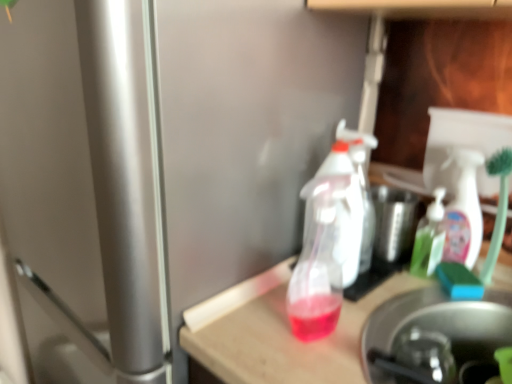
Question: Could translucent plastic spray bottle at center, the 1th bottle when ordered from left to right, be considered to be inside translucent plastic table at center?

Choices:
 (A) yes
 (B) no

Answer: (B)

Question: Is translucent plastic table at center next to translucent plastic spray bottle at center, positioned as the first bottle in front-to-back order?

Choices:
 (A) yes
 (B) no

Answer: (B)

Question: Does translucent plastic table at center have a greater height compared to translucent plastic spray bottle at center, the 1th bottle when ordered from left to right?

Choices:
 (A) yes
 (B) no

Answer: (A)

Question: Can you confirm if translucent plastic table at center is thinner than translucent plastic spray bottle at center, the 2th bottle positioned from the back?

Choices:
 (A) yes
 (B) no

Answer: (B)

Question: Is translucent plastic table at center bigger than translucent plastic spray bottle at center, the 1th bottle when ordered from left to right?

Choices:
 (A) no
 (B) yes

Answer: (B)

Question: Is the depth of translucent plastic table at center greater than that of translucent plastic spray bottle at center, the 2th bottle positioned from the back?

Choices:
 (A) yes
 (B) no

Answer: (B)

Question: Is stainless steel sink at lower right further to the viewer compared to translucent plastic spray bottle at center, which appears as the 2th bottle when viewed from the right?

Choices:
 (A) no
 (B) yes

Answer: (A)

Question: Can you confirm if stainless steel sink at lower right is shorter than translucent plastic spray bottle at center, which appears as the 2th bottle when viewed from the right?

Choices:
 (A) yes
 (B) no

Answer: (A)

Question: Is stainless steel sink at lower right at the left side of translucent plastic spray bottle at center, the 2th bottle positioned from the back?

Choices:
 (A) yes
 (B) no

Answer: (B)

Question: Considering the relative sizes of stainless steel sink at lower right and translucent plastic spray bottle at center, positioned as the first bottle in front-to-back order, in the image provided, is stainless steel sink at lower right smaller than translucent plastic spray bottle at center, positioned as the first bottle in front-to-back order,?

Choices:
 (A) no
 (B) yes

Answer: (A)

Question: Is translucent plastic spray bottle at center, the 2th bottle positioned from the back, inside stainless steel sink at lower right?

Choices:
 (A) no
 (B) yes

Answer: (A)

Question: From the image's perspective, is stainless steel sink at lower right under translucent plastic spray bottle at center, positioned as the first bottle in front-to-back order?

Choices:
 (A) yes
 (B) no

Answer: (A)

Question: Does green translucent soap dispenser at center, the first bottle positioned from the right, turn towards translucent plastic spray bottle at center, the 1th bottle when ordered from left to right?

Choices:
 (A) no
 (B) yes

Answer: (B)